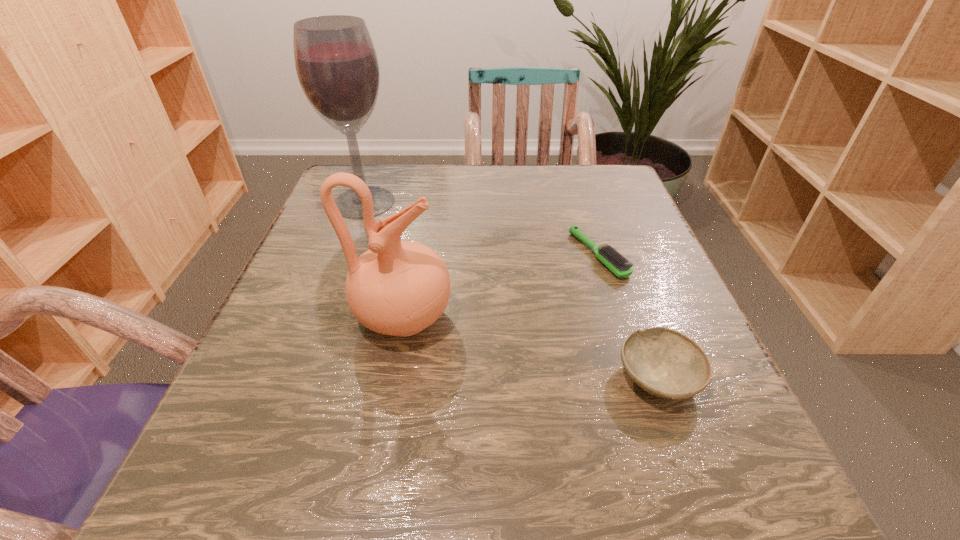
Where is `vacant space at the far left corner`? The width and height of the screenshot is (960, 540). vacant space at the far left corner is located at coordinates (341, 190).

Locate an element on the screen. This screenshot has height=540, width=960. unoccupied position between the third tallest object and the second tallest object is located at coordinates (531, 348).

Where is `free space between the hairbrush and the tallest object`? free space between the hairbrush and the tallest object is located at coordinates (481, 228).

What are the coordinates of `free space between the bowl and the pottery` in the screenshot? It's located at click(531, 348).

I want to click on unoccupied area between the hairbrush and the alcohol, so click(481, 228).

You are a GUI agent. You are given a task and a screenshot of the screen. Output one action in this format:
    pyautogui.click(x=<x>, y=<y>)
    Task: Click on the free space between the pottery and the hairbrush
    
    Given the screenshot: What is the action you would take?
    pyautogui.click(x=501, y=286)

The width and height of the screenshot is (960, 540). What are the coordinates of `free space between the third nearest object and the bowl` in the screenshot? It's located at (629, 316).

At what (x,y) coordinates should I click in order to perform the action: click on object that is the third closest to the farthest object. Please return your answer as a coordinate pair (x, y). The height and width of the screenshot is (540, 960). Looking at the image, I should click on (664, 362).

Where is `the second closest object to the second tallest object`? the second closest object to the second tallest object is located at coordinates (608, 256).

At what (x,y) coordinates should I click in order to perform the action: click on free spot that satisfies the following two spatial constraints: 1. on the front side of the bowl; 2. on the right side of the second farthest object. Please return your answer as a coordinate pair (x, y). Looking at the image, I should click on (639, 378).